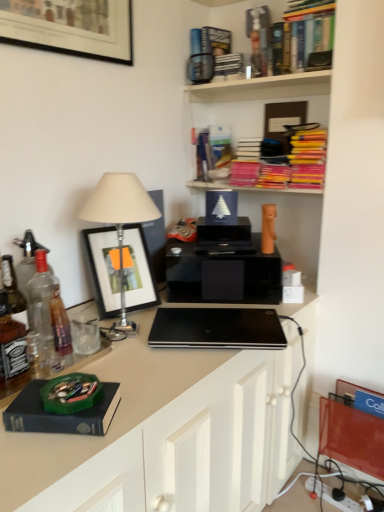
Question: Is pink matte books at upper center, arranged as the first shelf when ordered from the bottom, thinner than clear glass bottle at left?

Choices:
 (A) yes
 (B) no

Answer: (B)

Question: Are pink matte books at upper center, arranged as the first shelf when ordered from the bottom, and clear glass bottle at left beside each other?

Choices:
 (A) yes
 (B) no

Answer: (B)

Question: Is clear glass bottle at left inside pink matte books at upper center, the 3th shelf when ordered from top to bottom?

Choices:
 (A) no
 (B) yes

Answer: (A)

Question: Can you confirm if pink matte books at upper center, the 3th shelf when ordered from top to bottom, is positioned to the left of clear glass bottle at left?

Choices:
 (A) yes
 (B) no

Answer: (B)

Question: From a real-world perspective, is pink matte books at upper center, arranged as the first shelf when ordered from the bottom, located higher than clear glass bottle at left?

Choices:
 (A) yes
 (B) no

Answer: (A)

Question: Considering the positions of point (76, 431) and point (188, 73), is point (76, 431) closer or farther from the camera than point (188, 73)?

Choices:
 (A) farther
 (B) closer

Answer: (B)

Question: Is dark blue matte book at lower left wider or thinner than hardcover book at upper center, the 4th book positioned from the bottom?

Choices:
 (A) wide
 (B) thin

Answer: (A)

Question: Considering their positions, is dark blue matte book at lower left located in front of or behind hardcover book at upper center, the 4th book positioned from the bottom?

Choices:
 (A) behind
 (B) front

Answer: (B)

Question: Looking at the image, does dark blue matte book at lower left seem bigger or smaller compared to hardcover book at upper center, the 4th book positioned from the bottom?

Choices:
 (A) small
 (B) big

Answer: (A)

Question: In terms of height, does black matte laptop at center look taller or shorter compared to bright yellow markers at upper right, the first book when ordered from bottom to top?

Choices:
 (A) short
 (B) tall

Answer: (A)

Question: From a real-world perspective, is black matte laptop at center physically located above or below bright yellow markers at upper right, which is the 4th book from top to bottom?

Choices:
 (A) above
 (B) below

Answer: (B)

Question: In terms of width, does black matte laptop at center look wider or thinner when compared to bright yellow markers at upper right, the first book when ordered from bottom to top?

Choices:
 (A) wide
 (B) thin

Answer: (A)

Question: Is black matte laptop at center bigger or smaller than bright yellow markers at upper right, which is the 4th book from top to bottom?

Choices:
 (A) small
 (B) big

Answer: (A)

Question: Is clear glass bottle at left inside the boundaries of black matte laptop at center, or outside?

Choices:
 (A) inside
 (B) outside

Answer: (B)

Question: Does point (26, 367) appear closer or farther from the camera than point (238, 316)?

Choices:
 (A) farther
 (B) closer

Answer: (B)